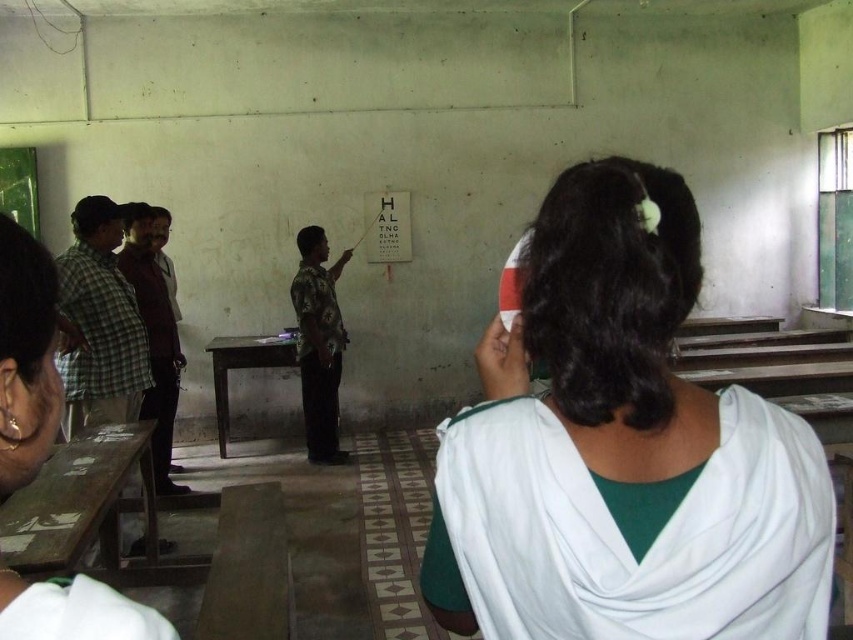
Question: Is white fabric headband at upper center further to the viewer compared to camouflage shirt at center?

Choices:
 (A) no
 (B) yes

Answer: (A)

Question: Is the position of green plaid shirt at left more distant than that of camouflage shirt at center?

Choices:
 (A) yes
 (B) no

Answer: (B)

Question: Is white fabric headband at upper center to the right of green plaid shirt at left from the viewer's perspective?

Choices:
 (A) yes
 (B) no

Answer: (A)

Question: Which object appears closest to the camera in this image?

Choices:
 (A) white fabric headband at upper center
 (B) green plaid shirt at left

Answer: (A)

Question: Which of the following is the closest to the observer?

Choices:
 (A) (120, 353)
 (B) (332, 413)

Answer: (A)

Question: Which point is closer to the camera?

Choices:
 (A) (132, 413)
 (B) (306, 269)
 (C) (747, 525)

Answer: (C)